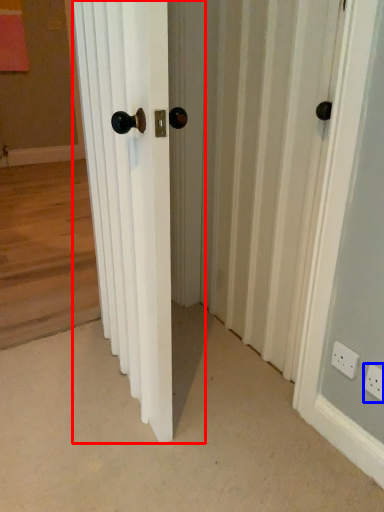
Question: Among these objects, which one is farthest to the camera, door (highlighted by a red box) or electric outlet (highlighted by a blue box)?

Choices:
 (A) door
 (B) electric outlet

Answer: (B)